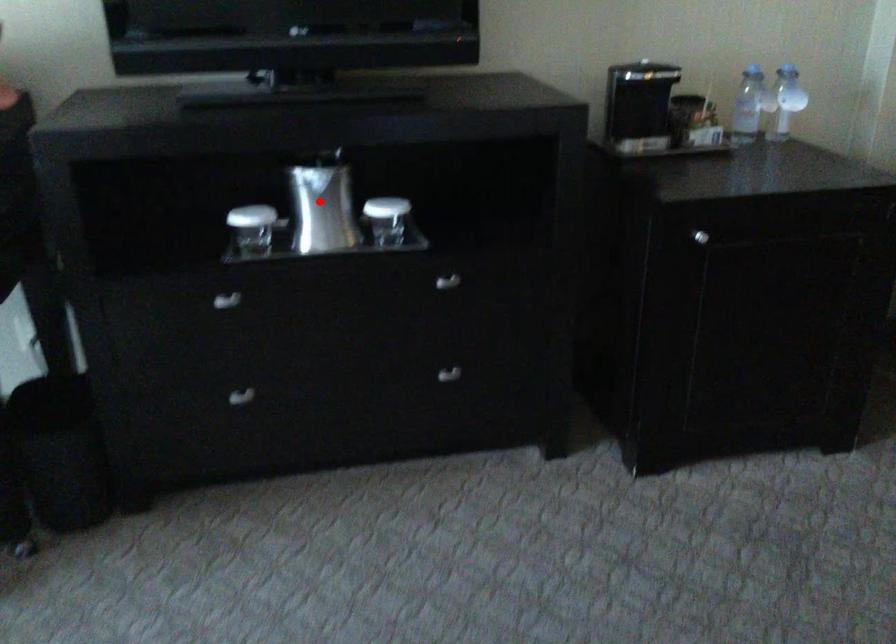
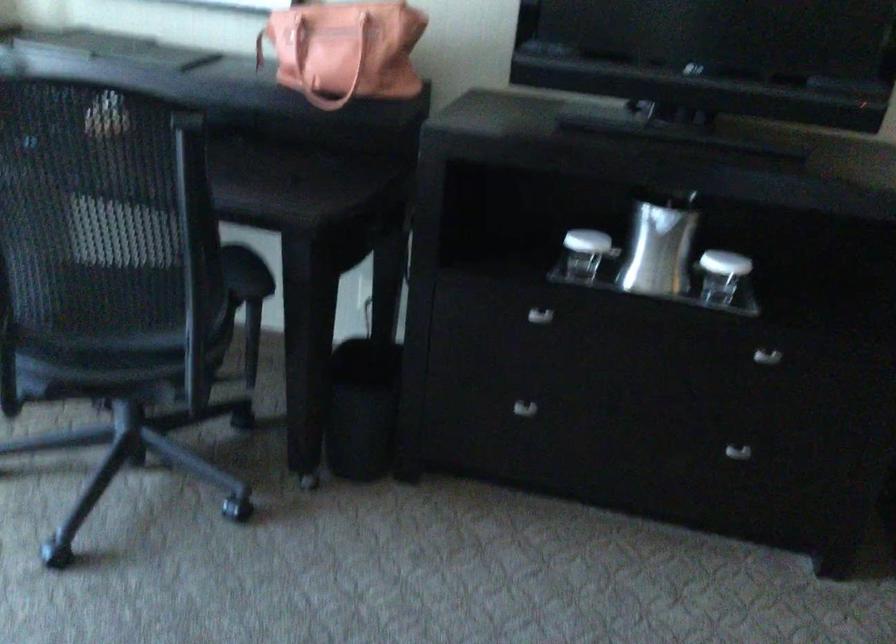
Find the pixel in the second image that matches the highlighted location in the first image.

(659, 245)